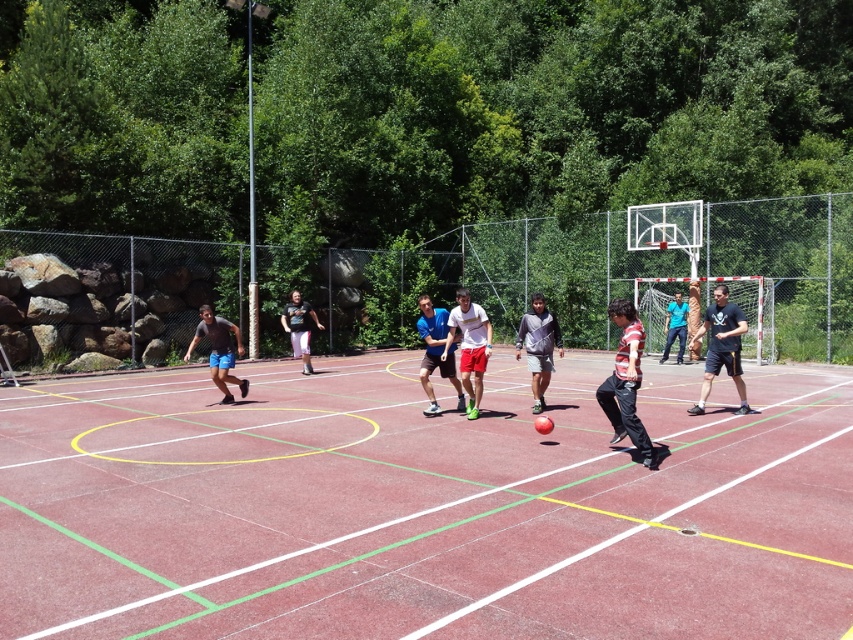
Is striped cotton shirt at center closer to the viewer compared to matte black shirt at center?

That is True.

Does point (625, 356) come behind point (288, 316)?

No, (625, 356) is closer to viewer.

Who is more forward, (x=630, y=305) or (x=312, y=310)?

Positioned in front is point (x=630, y=305).

At what (x,y) coordinates should I click in order to perform the action: click on striped cotton shirt at center. Please return your answer as a coordinate pair (x, y). The image size is (853, 640). Looking at the image, I should click on (625, 381).

At what (x,y) coordinates should I click in order to perform the action: click on dark blue athletic shorts at center. Please return your answer as a coordinate pair (x, y). Looking at the image, I should click on (721, 346).

Does point (722, 314) come farther from viewer compared to point (459, 403)?

No, (722, 314) is in front of (459, 403).

Locate an element on the screen. This screenshot has width=853, height=640. dark blue athletic shorts at center is located at coordinates (721, 346).

What do you see at coordinates (421, 509) in the screenshot?
I see `red rubber basketball court at center` at bounding box center [421, 509].

Measure the distance between red rubber basketball court at center and camera.

The distance of red rubber basketball court at center from camera is 4.67 meters.

Image resolution: width=853 pixels, height=640 pixels. I want to click on red rubber basketball court at center, so click(421, 509).

Where is `red rubber basketball court at center`? The height and width of the screenshot is (640, 853). red rubber basketball court at center is located at coordinates (421, 509).